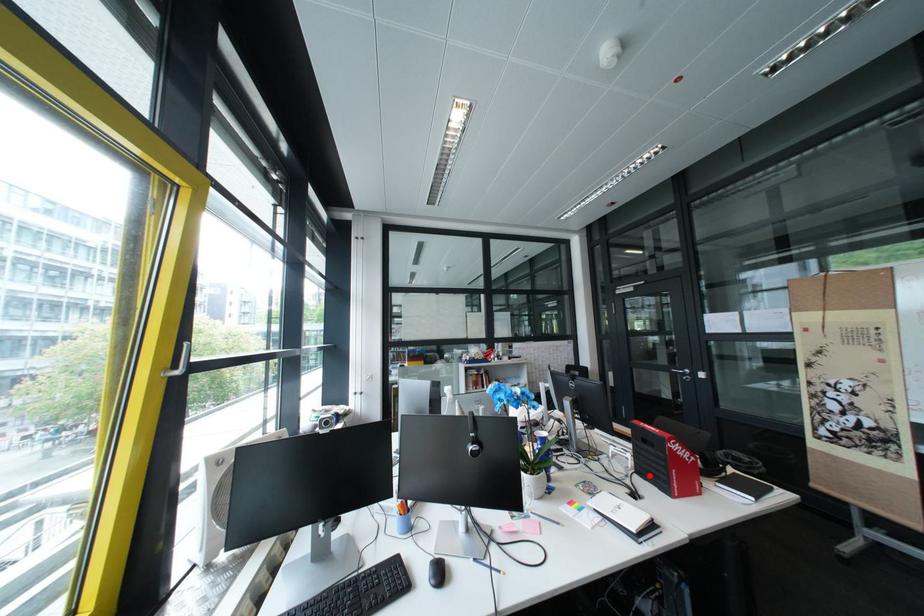
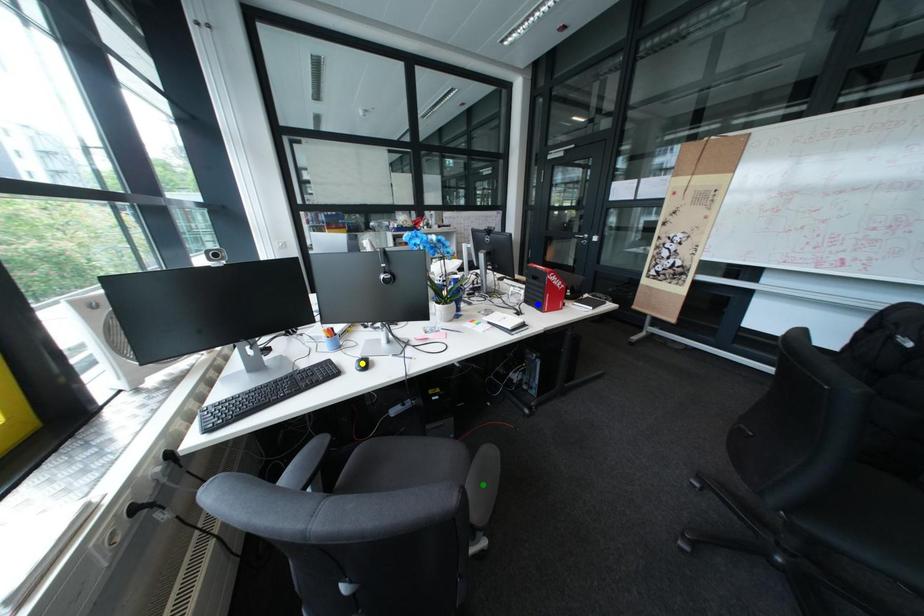
Question: I am providing you with two images of the same scene from different viewpoints. A red point is marked on the first image. You are given multiple points on the second image. In image 2, which mark is for the same physical point as the one in image 1?

Choices:
 (A) green point
 (B) blue point
 (C) yellow point

Answer: (B)